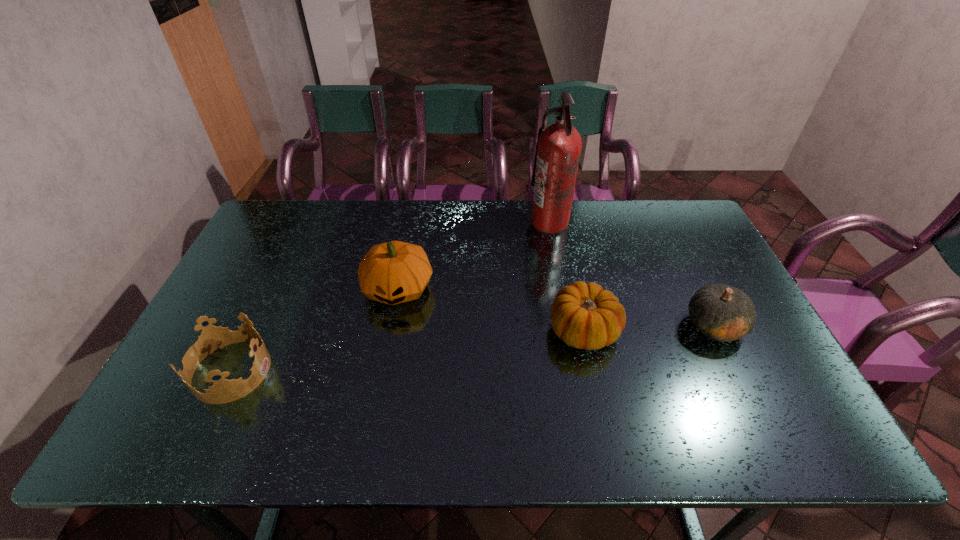
In order to click on vacant space at the right edge of the desktop in this screenshot , I will do `click(708, 250)`.

What are the coordinates of `vacant space at the far left corner` in the screenshot? It's located at (273, 227).

The image size is (960, 540). In the image, there is a desktop. In order to click on free space at the far right corner in this screenshot , I will do `click(654, 226)`.

Find the location of a particular element. This screenshot has height=540, width=960. free area in between the fourth object from right to left and the farthest object is located at coordinates (473, 255).

Where is `empty location between the tiara and the second gourd from left to right`? This screenshot has height=540, width=960. empty location between the tiara and the second gourd from left to right is located at coordinates (407, 350).

Where is `empty space between the tallest object and the second gourd from left to right`? The height and width of the screenshot is (540, 960). empty space between the tallest object and the second gourd from left to right is located at coordinates (566, 276).

I want to click on free point between the tiara and the fourth object from right to left, so click(x=315, y=329).

Image resolution: width=960 pixels, height=540 pixels. Find the location of `empty space that is in between the rightmost object and the tiara`. empty space that is in between the rightmost object and the tiara is located at coordinates (473, 348).

The height and width of the screenshot is (540, 960). Find the location of `free space between the fourth shortest object and the second gourd from right to left`. free space between the fourth shortest object and the second gourd from right to left is located at coordinates (491, 309).

This screenshot has width=960, height=540. What are the coordinates of `free area in between the second gourd from left to right and the fourth shortest object` in the screenshot? It's located at (491, 309).